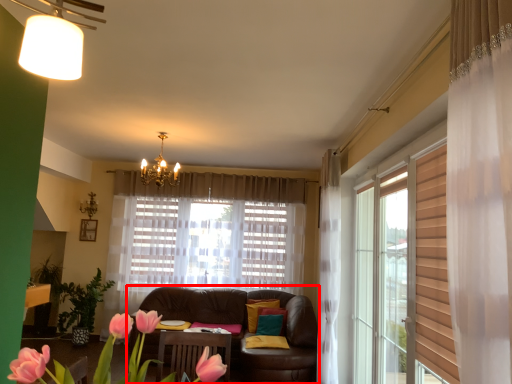
Question: From the image's perspective, where is studio couch (annotated by the red box) located in relation to floral arrangement in the image?

Choices:
 (A) above
 (B) below

Answer: (B)